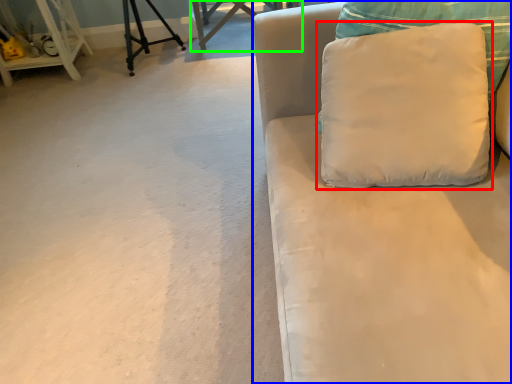
Question: Which is nearer to the pillow (highlighted by a red box)? studio couch (highlighted by a blue box) or table (highlighted by a green box).

Choices:
 (A) studio couch
 (B) table

Answer: (A)